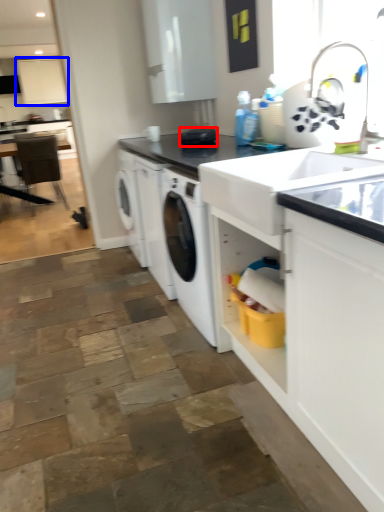
Question: Which point is further to the camera, appliance (highlighted by a red box) or cabinetry (highlighted by a blue box)?

Choices:
 (A) appliance
 (B) cabinetry

Answer: (B)